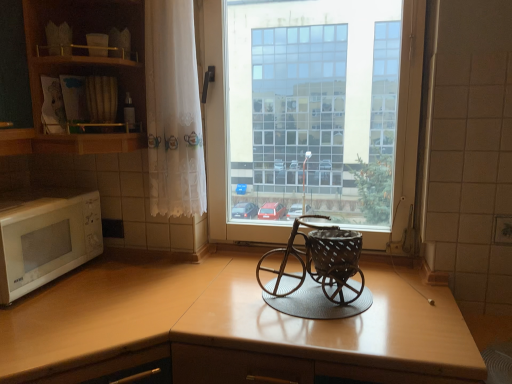
Image resolution: width=512 pixels, height=384 pixels. Find the location of `vacant area in front of rustic metal bicycle at center`. vacant area in front of rustic metal bicycle at center is located at coordinates (323, 333).